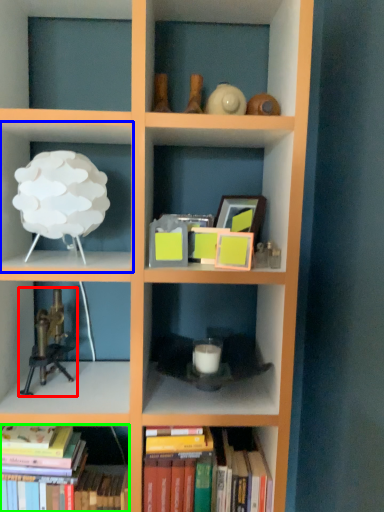
Question: Considering the real-world distances, which object is closest to toy (highlighted by a red box)? shelf (highlighted by a blue box) or book (highlighted by a green box).

Choices:
 (A) shelf
 (B) book

Answer: (B)